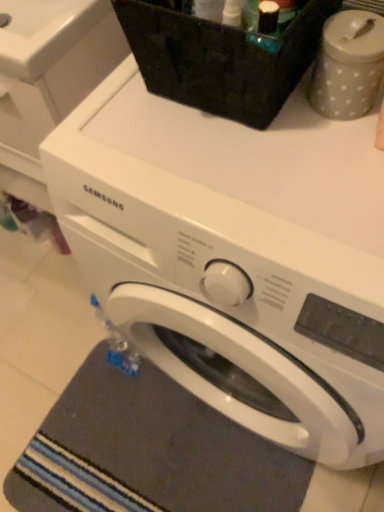
Question: From a real-world perspective, is white glossy sink at upper left physically below dark gray textured bath mat at lower left?

Choices:
 (A) yes
 (B) no

Answer: (B)

Question: Does white glossy sink at upper left have a greater height compared to dark gray textured bath mat at lower left?

Choices:
 (A) yes
 (B) no

Answer: (A)

Question: Can you confirm if white glossy sink at upper left is shorter than dark gray textured bath mat at lower left?

Choices:
 (A) no
 (B) yes

Answer: (A)

Question: From the image's perspective, is white glossy sink at upper left below dark gray textured bath mat at lower left?

Choices:
 (A) yes
 (B) no

Answer: (B)

Question: Is dark gray textured bath mat at lower left located within white glossy sink at upper left?

Choices:
 (A) no
 (B) yes

Answer: (A)

Question: Considering the positions of dark gray textured bath mat at lower left and gray dotted container at upper right in the image, is dark gray textured bath mat at lower left wider or thinner than gray dotted container at upper right?

Choices:
 (A) thin
 (B) wide

Answer: (B)

Question: Relative to gray dotted container at upper right, is dark gray textured bath mat at lower left in front or behind?

Choices:
 (A) front
 (B) behind

Answer: (B)

Question: Would you say dark gray textured bath mat at lower left is inside or outside gray dotted container at upper right?

Choices:
 (A) outside
 (B) inside

Answer: (A)

Question: Considering the positions of dark gray textured bath mat at lower left and gray dotted container at upper right in the image, is dark gray textured bath mat at lower left bigger or smaller than gray dotted container at upper right?

Choices:
 (A) big
 (B) small

Answer: (A)

Question: Considering the positions of white matte washing machine at upper center, which is counted as the second washing machine, starting from the right, and white glossy sink at upper left in the image, is white matte washing machine at upper center, which is counted as the second washing machine, starting from the right, taller or shorter than white glossy sink at upper left?

Choices:
 (A) tall
 (B) short

Answer: (A)

Question: In the image, is white matte washing machine at upper center, which appears as the 1th washing machine when viewed from the left, on the left side or the right side of white glossy sink at upper left?

Choices:
 (A) right
 (B) left

Answer: (B)

Question: Is white matte washing machine at upper center, which appears as the 1th washing machine when viewed from the left, wider or thinner than white glossy sink at upper left?

Choices:
 (A) thin
 (B) wide

Answer: (B)

Question: Is white matte washing machine at upper center, which appears as the 1th washing machine when viewed from the left, inside or outside of white glossy sink at upper left?

Choices:
 (A) inside
 (B) outside

Answer: (B)

Question: From their relative heights in the image, would you say white glossy sink at upper left is taller or shorter than gray dotted container at upper right?

Choices:
 (A) short
 (B) tall

Answer: (A)

Question: From the image's perspective, is white glossy sink at upper left located above or below gray dotted container at upper right?

Choices:
 (A) below
 (B) above

Answer: (B)